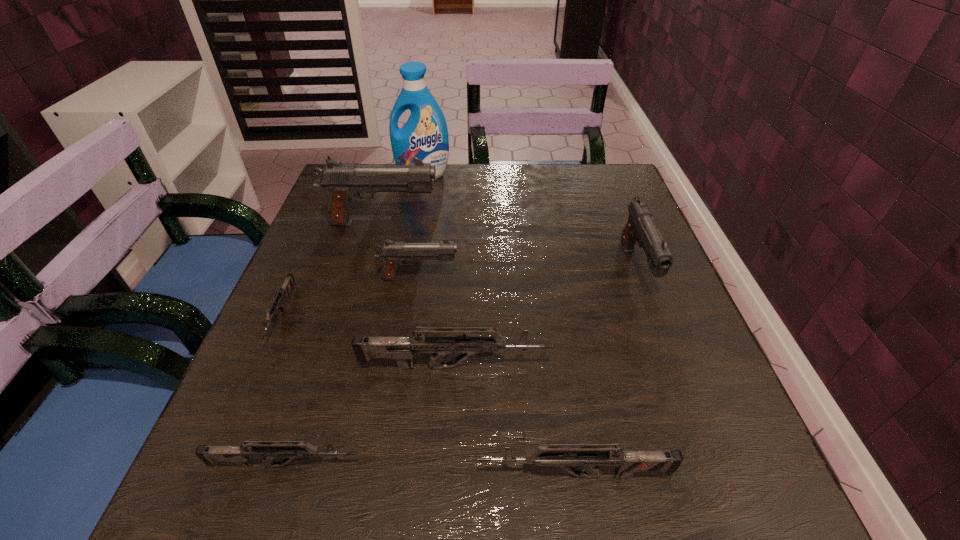
This screenshot has width=960, height=540. In order to click on empty space between the third shortest gun and the second shortest gun in this screenshot , I will do `click(430, 470)`.

Identify the location of blank region between the smallest gray gun and the shortest object. (350, 297).

Find the location of a particular element. The width and height of the screenshot is (960, 540). vacant space that's between the third nearest gun and the second smallest grey gun is located at coordinates (370, 416).

In order to click on free point between the biggest grey gun and the second biggest grey gun in this screenshot , I will do `click(515, 421)`.

Locate an element on the screen. The image size is (960, 540). vacant space that is in between the fifth tallest gun and the third nearest object is located at coordinates (515, 421).

Where is `free area in between the farthest grey gun and the second biggest grey gun`? This screenshot has height=540, width=960. free area in between the farthest grey gun and the second biggest grey gun is located at coordinates (428, 395).

Select which object is the fourth closest to the biggest grey gun. Please provide its 2D coordinates. Your answer should be formatted as a tuple, i.e. [(x, y)], where the tuple contains the x and y coordinates of a point satisfying the conditions above.

[(392, 253)]

You are a GUI agent. You are given a task and a screenshot of the screen. Output one action in this format:
    pyautogui.click(x=<x>, y=<y>)
    Task: Click on the object that is the sixth closest to the second tallest object
    This screenshot has width=960, height=540.
    Given the screenshot: What is the action you would take?
    pyautogui.click(x=268, y=450)

Identify the location of the sixth closest gun to the rightmost object. (283, 292).

Image resolution: width=960 pixels, height=540 pixels. In order to click on gun object that ranks as the third closest to the smallest gray gun in this screenshot , I will do `click(402, 349)`.